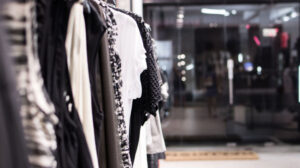
Image resolution: width=300 pixels, height=168 pixels. In order to click on door magnets in this screenshot , I will do `click(232, 144)`, `click(269, 145)`.